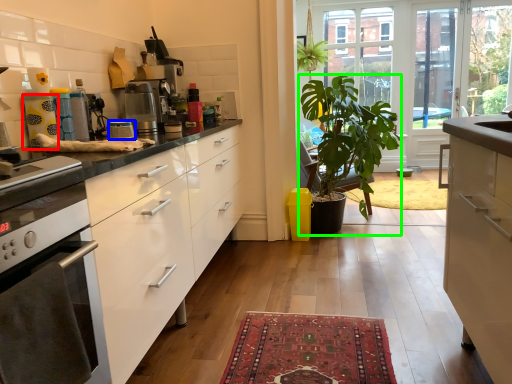
Question: Which is farther away from appliance (highlighted by a red box)? appliance (highlighted by a blue box) or houseplant (highlighted by a green box)?

Choices:
 (A) appliance
 (B) houseplant

Answer: (B)